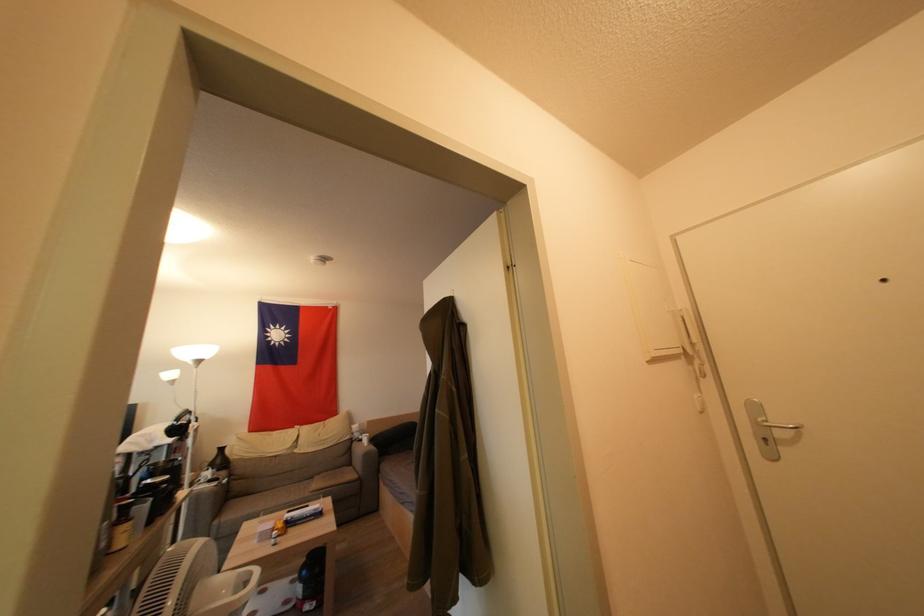
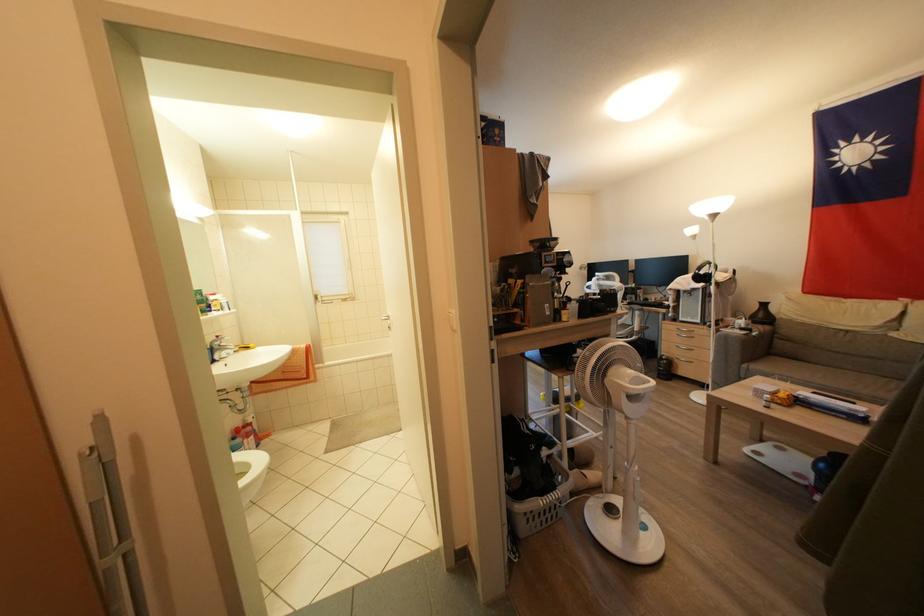
Question: I am providing you with two images of the same scene from different viewpoints. Please identify which objects are invisible in image2.

Choices:
 (A) shower door handle
 (B) black vase
 (C) sofa sitting surface
 (D) none of these

Answer: (D)